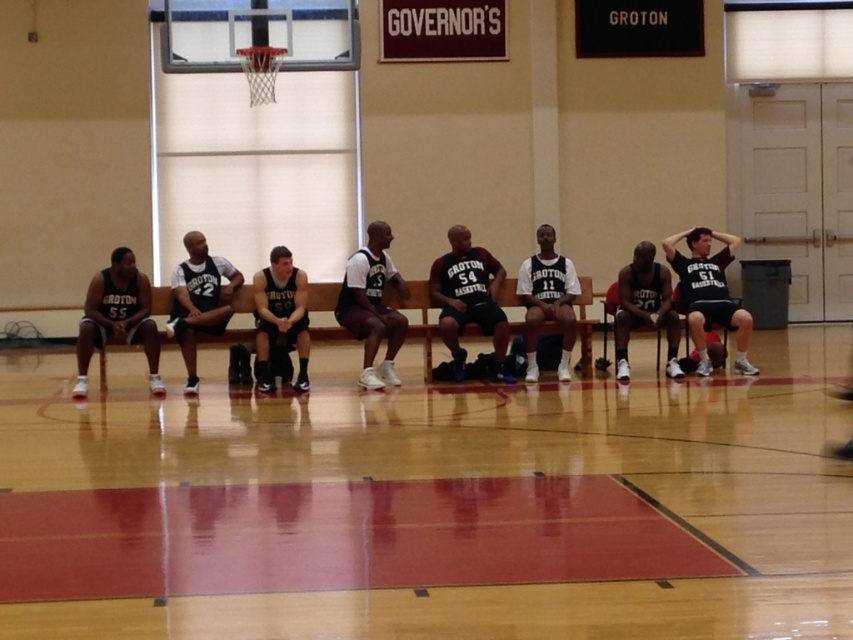
You are a janitor in the gym and need to clean the wooden floor at center and the matte gray jersey at center. Which one has a greater width?

The wooden floor at center has a greater width than the matte gray jersey at center.

You are standing in the gymnasium and want to determine which of the two points, point (x=357, y=269) or point (x=279, y=266), is closer to you. Based on the image, which point is nearer?

Point (x=357, y=269) is closer to the camera than point (x=279, y=266).

You are a photographer setting up a shot of the basketball team. You need to ensure that the dark gray jersey at center and the matte black shorts at left are both in focus. Given that your camera can only focus on objects within a 1.2 meter width range, will both items fit within this range?

The dark gray jersey at center has a larger width than the matte black shorts at left. Since the camera can focus on objects within a 1.2 meter width range, and the total width difference between the two items is within this range, both items should fit within the focus range.